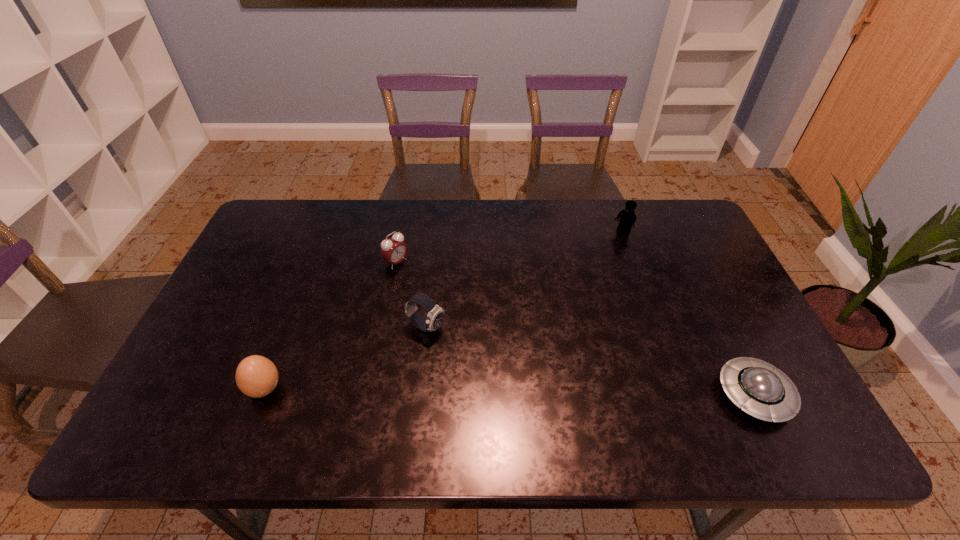
Where is `boiled egg`? Image resolution: width=960 pixels, height=540 pixels. boiled egg is located at coordinates (256, 376).

This screenshot has width=960, height=540. In order to click on the shortest object in this screenshot , I will do `click(762, 391)`.

Where is `the rightmost object`? The image size is (960, 540). the rightmost object is located at coordinates (762, 391).

This screenshot has height=540, width=960. I want to click on watch, so click(435, 315).

The image size is (960, 540). In order to click on the third object from right to left in this screenshot , I will do `click(435, 315)`.

This screenshot has height=540, width=960. In order to click on the farthest object in this screenshot , I will do `click(627, 217)`.

The height and width of the screenshot is (540, 960). I want to click on Lego, so click(627, 217).

Where is `alarm clock`? alarm clock is located at coordinates (393, 249).

Locate an element on the screen. the second farthest object is located at coordinates (393, 249).

The width and height of the screenshot is (960, 540). What are the coordinates of `vacant space situated on the right of the leftmost object` in the screenshot? It's located at (343, 389).